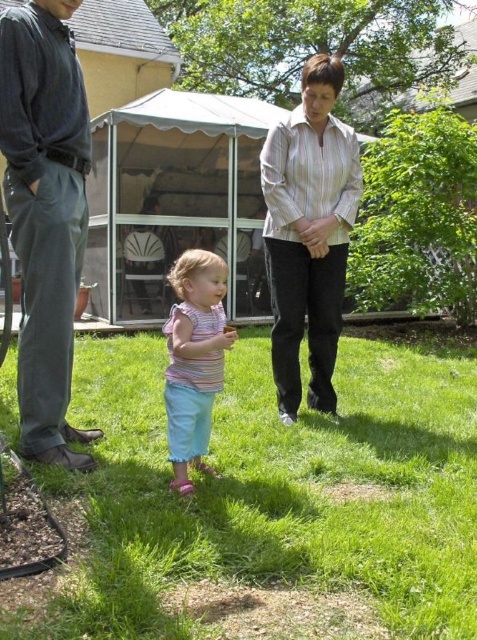
Question: Which point is farther from the camera taking this photo?

Choices:
 (A) (371, 476)
 (B) (315, 301)
 (C) (30, 125)
 (D) (199, 316)

Answer: (B)

Question: Can you confirm if dark gray pants at left is positioned to the right of striped shirt at center?

Choices:
 (A) no
 (B) yes

Answer: (A)

Question: Does green grass at center appear on the left side of dark gray pants at left?

Choices:
 (A) yes
 (B) no

Answer: (B)

Question: Which of these objects is positioned closest to the striped shirt at center?

Choices:
 (A) green grass at center
 (B) dark gray pants at left

Answer: (A)

Question: Which object is farther from the camera taking this photo?

Choices:
 (A) striped shirt at center
 (B) green grass at center

Answer: (A)

Question: Is green grass at center to the right of striped shirt at center from the viewer's perspective?

Choices:
 (A) no
 (B) yes

Answer: (A)